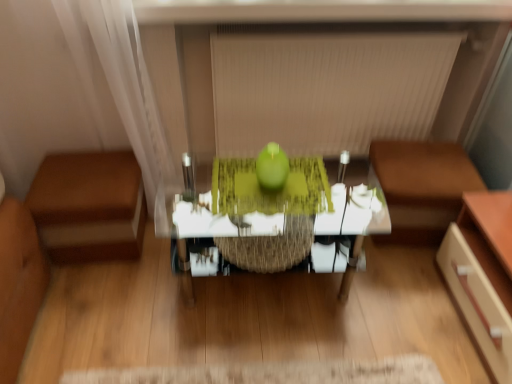
Question: From a real-world perspective, relative to brown leather couch at right, which ranks as the second furniture in left-to-right order, is beige fabric blind at upper center vertically above or below?

Choices:
 (A) below
 (B) above

Answer: (B)

Question: Considering the positions of beige fabric blind at upper center and brown leather couch at right, which ranks as the second furniture in left-to-right order, in the image, is beige fabric blind at upper center taller or shorter than brown leather couch at right, which ranks as the second furniture in left-to-right order,?

Choices:
 (A) tall
 (B) short

Answer: (A)

Question: Which object is the farthest from the beige fabric blind at upper center?

Choices:
 (A) brown leather ottoman at left, which is the first furniture in left-to-right order
 (B) brown leather couch at right, the 1th furniture from the right
 (C) green matte apple at center
 (D) translucent glass table at center

Answer: (A)

Question: Which object is the closest to the brown leather ottoman at left, which is the 2th furniture from right to left?

Choices:
 (A) translucent glass table at center
 (B) brown leather couch at right, which ranks as the second furniture in left-to-right order
 (C) green matte apple at center
 (D) beige fabric blind at upper center

Answer: (A)